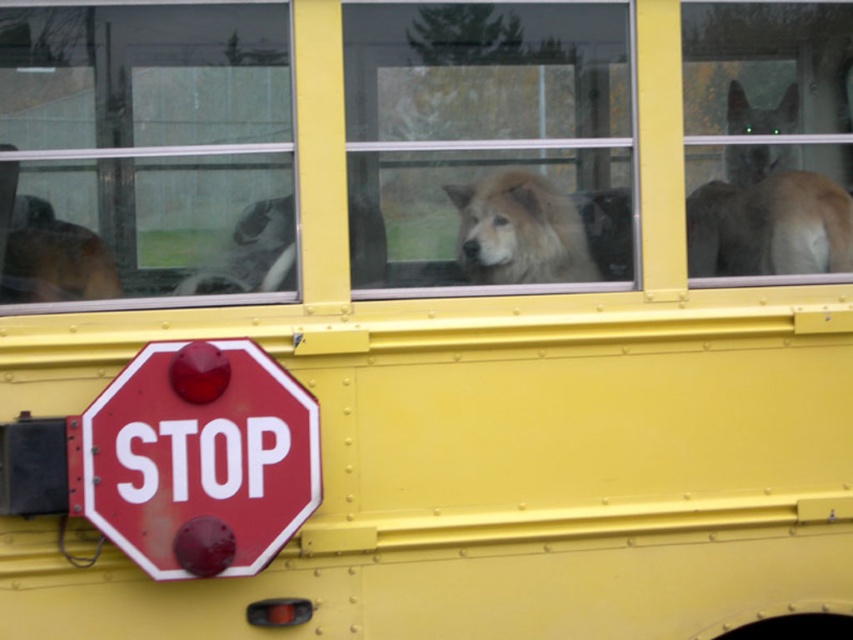
You are standing next to the yellow school bus and want to see the dogs inside through the transparent glass window at upper left. Where should you position yourself relative to the bus to view them?

To view the dogs inside through the transparent glass window at upper left, you should position yourself at the upper left side of the bus since the window is located at point [144,150], which corresponds to the upper left area.

You are a delivery person who needs to place a 12 inch box between the translucent glass dog at upper right and the fluffy white dog at center. Can you fit the box between them without moving either dog?

The distance between the translucent glass dog at upper right and the fluffy white dog at center is 20.08 inches. Since the box is only 12 inches long, there is enough space to place it between them without moving the dogs.